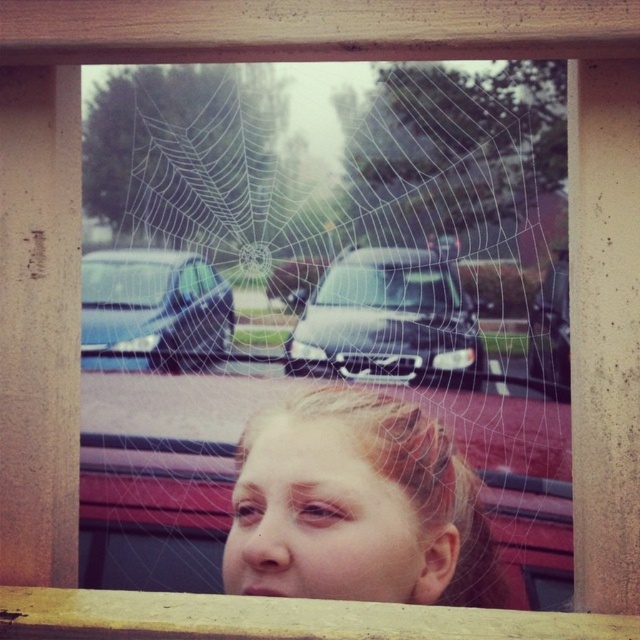
You are standing in front of the wooden frame and see the transparent glass spider web at center and the metallic silver car at center. Which object is closer to you?

The transparent glass spider web at center is closer to the viewer than the metallic silver car at center.

You are a photographer analyzing the composition of this image. You notice the smooth skin face at center and the satin black car at center. Which object occupies more vertical space in the frame?

The smooth skin face at center is taller than the satin black car at center, so it occupies more vertical space in the frame.